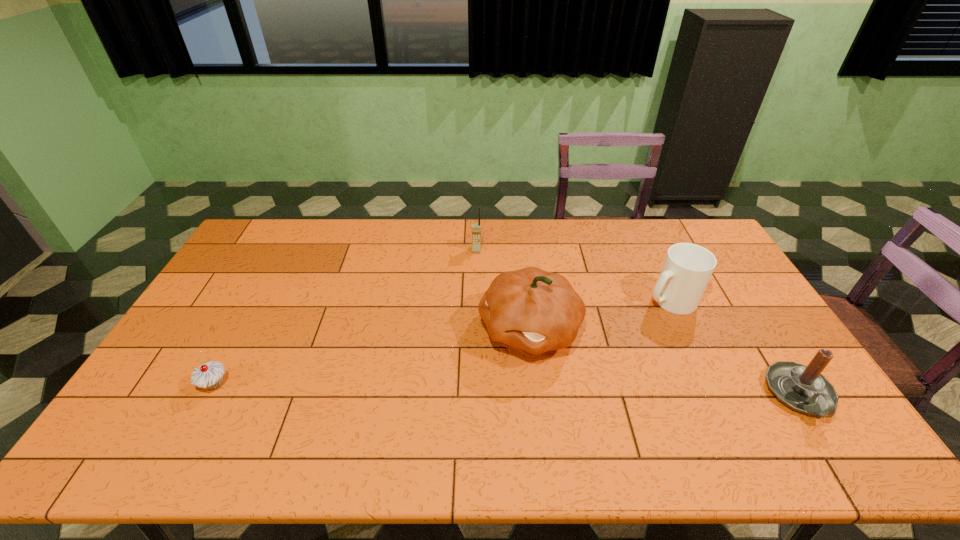
You are a GUI agent. You are given a task and a screenshot of the screen. Output one action in this format:
    pyautogui.click(x=<x>, y=<y>)
    Task: Click on the free spot on the desktop that is between the shortest object and the candle and is positioned on the handle side of the fourth object from left to right
    The image size is (960, 540).
    Given the screenshot: What is the action you would take?
    pyautogui.click(x=547, y=390)

This screenshot has width=960, height=540. I want to click on free spot on the desktop that is between the leftmost object and the rightmost object and is positioned on the front face of the pumpkin, so click(446, 388).

I want to click on free spot on the desktop that is between the shortest object and the candle and is positioned on the front of the cellular telephone, where the keypad is located, so click(x=462, y=389).